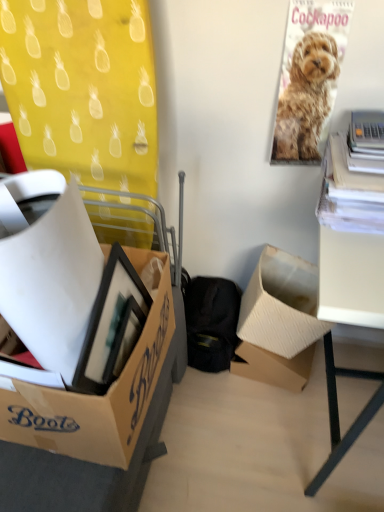
Question: Considering the positions of point (87, 428) and point (311, 323), is point (87, 428) closer or farther from the camera than point (311, 323)?

Choices:
 (A) farther
 (B) closer

Answer: (B)

Question: From the image's perspective, relative to cardboard box at center, arranged as the third box when viewed from the front, is cardboard box at left, which is the second box from front to back, above or below?

Choices:
 (A) below
 (B) above

Answer: (A)

Question: Considering the real-world distances, which object is farthest from the cardboard box at center, marked as the 2th box in a back-to-front arrangement?

Choices:
 (A) cardboard box at left, which is counted as the third box, starting from the back
 (B) white matte desk at right
 (C) golden fur poster at upper right
 (D) cardboard box at center, arranged as the 1th box when viewed from the back
 (E) cardboard box at left, positioned as the 4th box in back-to-front order

Answer: (E)

Question: Based on their relative distances, which object is nearer to the golden fur poster at upper right?

Choices:
 (A) cardboard box at left, placed as the 1th box when sorted from front to back
 (B) cardboard box at center, which is the fourth box in front-to-back order
 (C) cardboard box at left, which is the second box from front to back
 (D) white matte desk at right
 (E) cardboard box at center, marked as the 2th box in a back-to-front arrangement

Answer: (E)